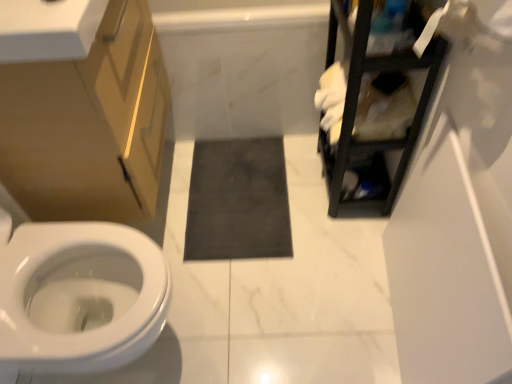
Identify the location of vacant space in front of black metal shelving unit at upper right. The image size is (512, 384). (340, 255).